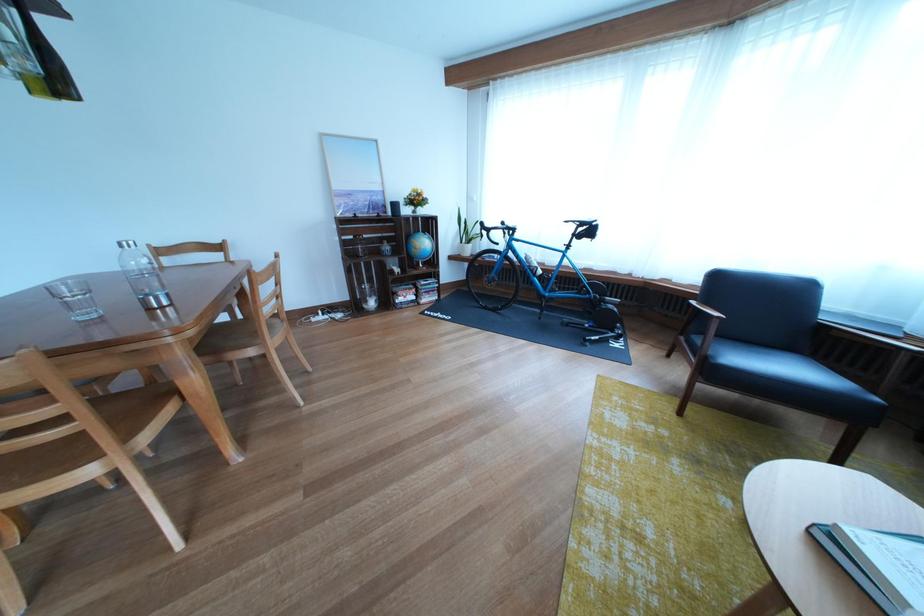
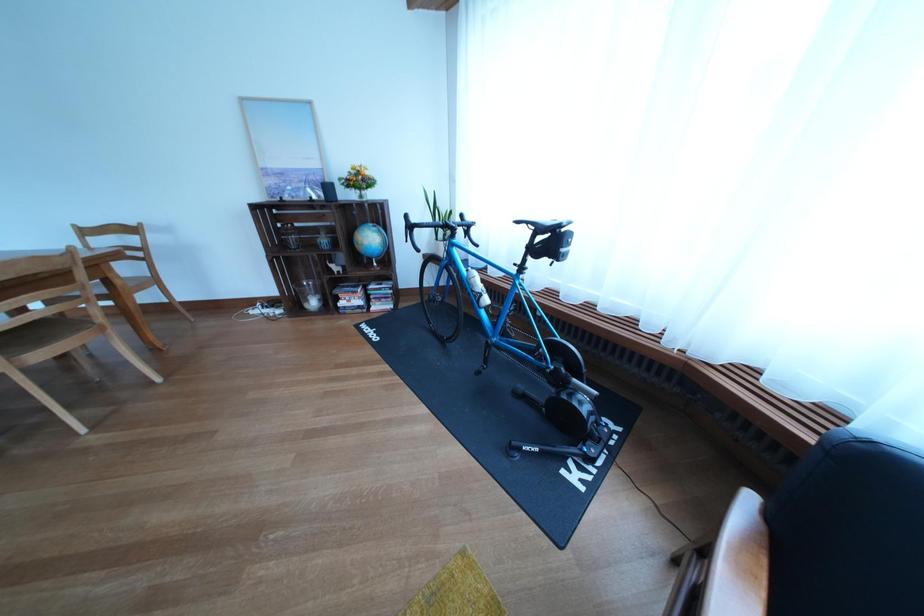
Where in the second image is the point corresponding to point 430,206 from the first image?

(372, 185)